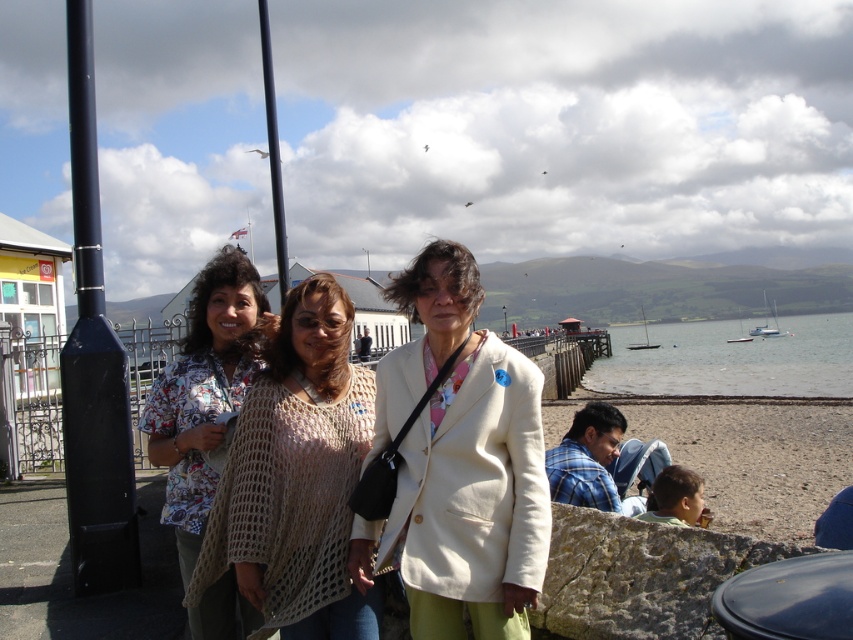
Is crochet beige shawl at center below smooth sand at lower right?

No.

Can you confirm if crochet beige shawl at center is shorter than smooth sand at lower right?

Indeed, crochet beige shawl at center has a lesser height compared to smooth sand at lower right.

This screenshot has height=640, width=853. Identify the location of crochet beige shawl at center. (297, 476).

The width and height of the screenshot is (853, 640). Identify the location of crochet beige shawl at center. (297, 476).

Can you confirm if crochet beige shawl at center is positioned above clear water at lower right?

Indeed, crochet beige shawl at center is positioned over clear water at lower right.

Is crochet beige shawl at center behind clear water at lower right?

No, crochet beige shawl at center is closer to the viewer.

I want to click on crochet beige shawl at center, so point(297,476).

The height and width of the screenshot is (640, 853). What are the coordinates of `crochet beige shawl at center` in the screenshot? It's located at (297, 476).

Between point (761, 394) and point (279, 244), which one is positioned behind?

Positioned behind is point (761, 394).

Which of these two, clear water at lower right or black metal pole at upper center, stands taller?

black metal pole at upper center is taller.

Describe the element at coordinates (730, 358) in the screenshot. The image size is (853, 640). I see `clear water at lower right` at that location.

Where is `clear water at lower right`? This screenshot has height=640, width=853. clear water at lower right is located at coordinates (730, 358).